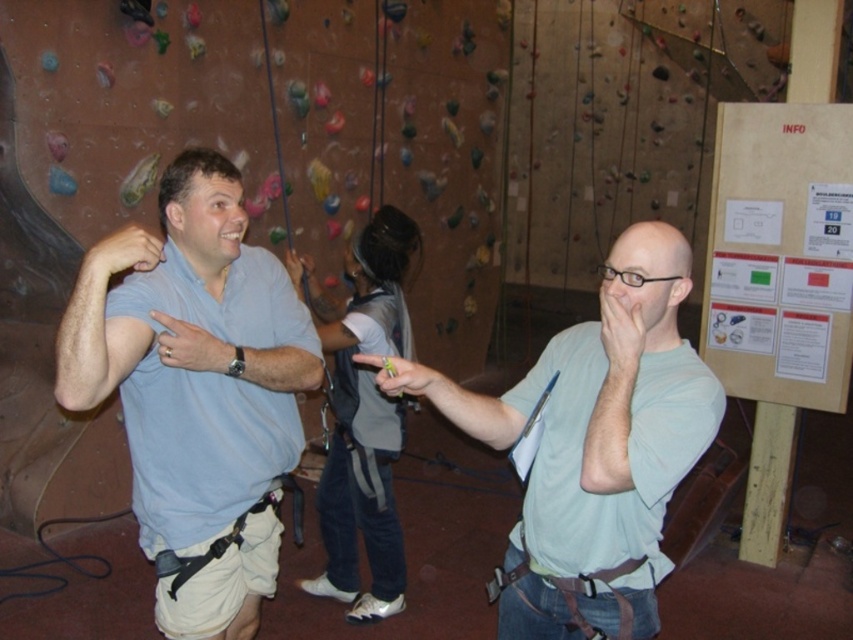
Who is positioned more to the right, light blue shirt at center or light green t-shirt at center?

light green t-shirt at center is more to the right.

Can you confirm if light blue shirt at center is positioned to the right of light green t-shirt at center?

Incorrect, light blue shirt at center is not on the right side of light green t-shirt at center.

Who is more forward, (190, 628) or (508, 444)?

Point (508, 444)

Identify the location of light blue shirt at center. [x=196, y=385].

Can you confirm if light green t-shirt at center is thinner than dark gray climbing harness at center?

No, light green t-shirt at center is not thinner than dark gray climbing harness at center.

Image resolution: width=853 pixels, height=640 pixels. What do you see at coordinates (595, 444) in the screenshot?
I see `light green t-shirt at center` at bounding box center [595, 444].

Locate an element on the screen. light green t-shirt at center is located at coordinates (595, 444).

This screenshot has width=853, height=640. Find the location of `light green t-shirt at center`. light green t-shirt at center is located at coordinates (595, 444).

Which is below, light blue shirt at center or dark gray climbing harness at center?

Positioned lower is dark gray climbing harness at center.

Where is `light blue shirt at center`? light blue shirt at center is located at coordinates (196, 385).

Identify the location of light blue shirt at center. (196, 385).